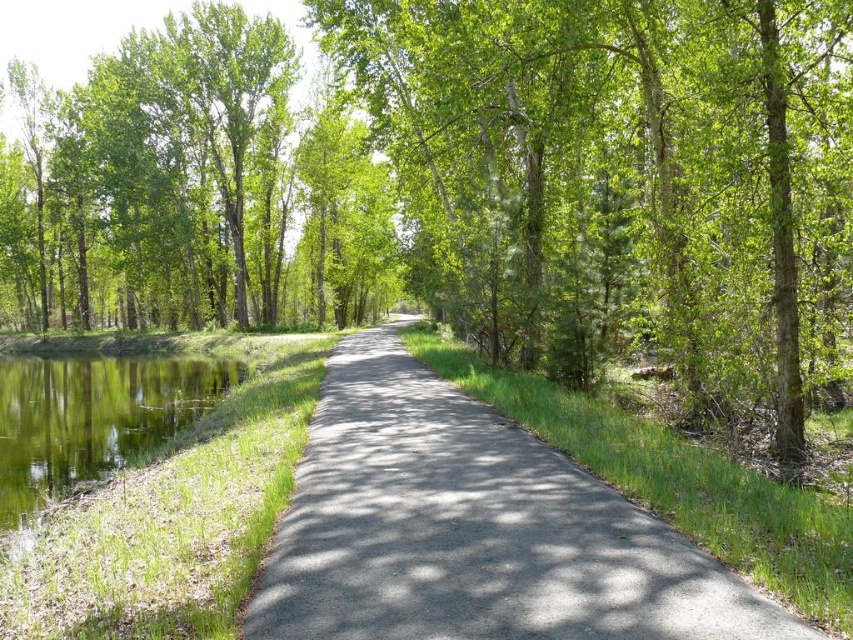
You are standing at the starting point of the path and want to reach the end of the path. Which point, point (793, 634) or point (6, 460), is closer to you as you begin your walk?

Point (793, 634) is closer to the viewer than point (6, 460), so you would reach point (793, 634) first as you begin your walk.

You are a hiker carrying a heavy backpack and need to cross from the gray asphalt trail at center to the green grassy water at left. The trail is narrow and slippery. What is the shortest distance you must walk to reach the water?

The shortest distance you must walk to reach the green grassy water at left from the gray asphalt trail at center is 14.83 meters.

You are a hiker walking along the path and want to take a photo of the green leafy tree at center and the green grassy water at left. Which object should you focus on first to ensure both are in the frame?

You should focus on the green leafy tree at center first because it is closer to you than the green grassy water at left, so it will be in the foreground of your photo.